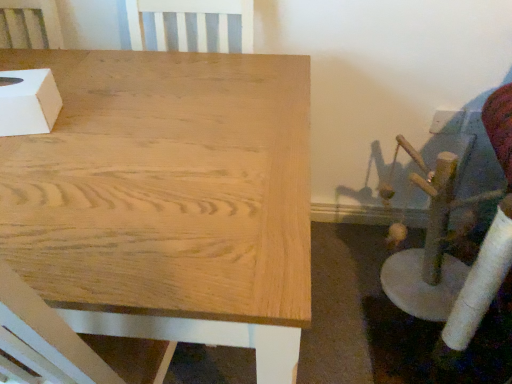
At what (x,y) coordinates should I click in order to perform the action: click on free location to the right of white matte tissue box at upper left. Please return your answer as a coordinate pair (x, y). Looking at the image, I should click on (91, 117).